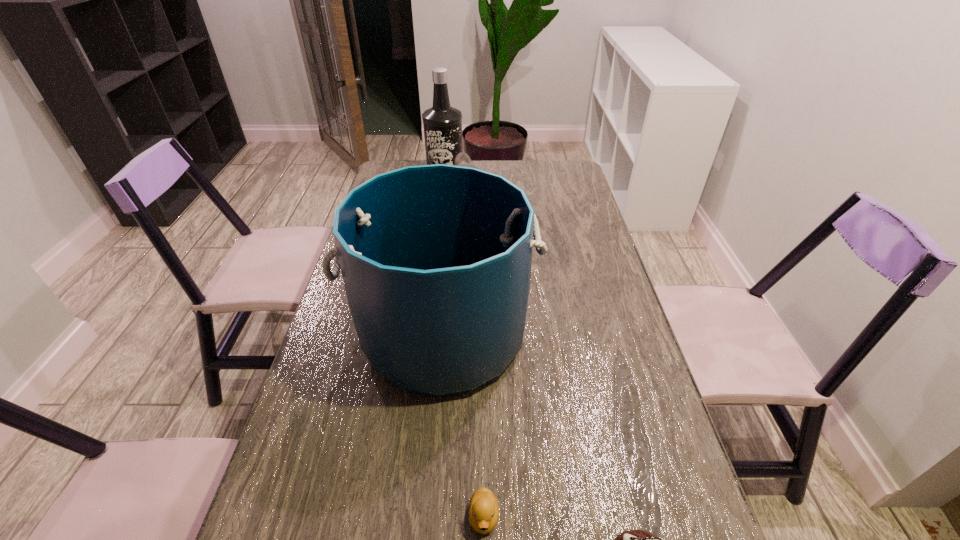
This screenshot has height=540, width=960. In order to click on liquor in this screenshot , I will do `click(442, 123)`.

Where is `the third nearest object`? the third nearest object is located at coordinates (436, 260).

The width and height of the screenshot is (960, 540). What are the coordinates of `the third shortest object` in the screenshot? It's located at (462, 159).

Image resolution: width=960 pixels, height=540 pixels. Identify the location of the second farthest object. (462, 159).

What are the coordinates of `free space located 0.280m on the front label of the liquor` in the screenshot? It's located at (439, 218).

Where is `vacant area located on the right of the third nearest object`? The width and height of the screenshot is (960, 540). vacant area located on the right of the third nearest object is located at coordinates (589, 334).

Find the location of `vacant space located 0.310m on the face of the hamster`. vacant space located 0.310m on the face of the hamster is located at coordinates (577, 214).

Where is `object that is positioned at the far edge`? The image size is (960, 540). object that is positioned at the far edge is located at coordinates (442, 123).

Identify the location of object that is positioned at the left edge. This screenshot has width=960, height=540. (436, 260).

Where is `vacant space at the far edge of the desktop`? vacant space at the far edge of the desktop is located at coordinates (526, 168).